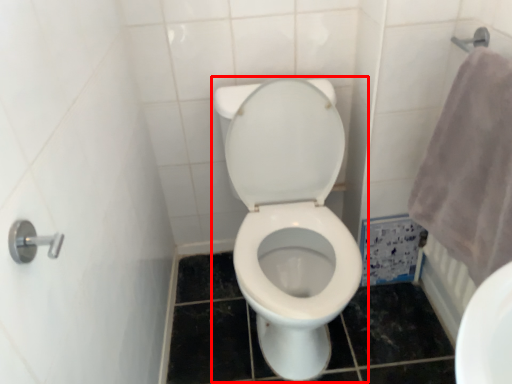
Question: Observing the image, what is the correct spatial positioning of toilet (annotated by the red box) in reference to bath towel?

Choices:
 (A) right
 (B) left

Answer: (B)